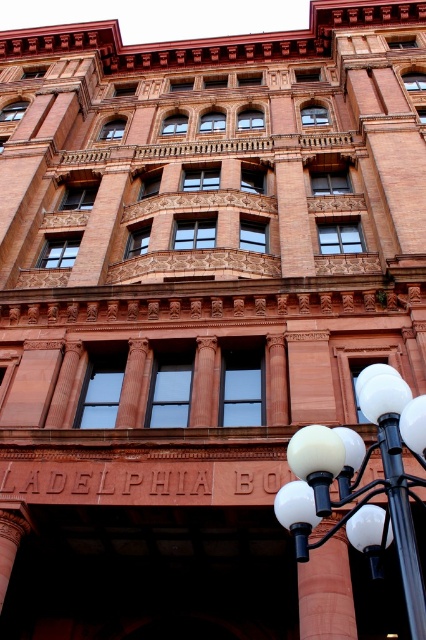
You are standing in front of the grand building and want to determine the relative positions of two points marked on its facade. Which of the two points, point (317, 490) or point (402, 470), is closer to you?

Point (317, 490) is closer to you because it is further to the viewer than point (402, 470).

You are standing in front of the grand building named ADELPHIA. You notice a white glass street light at lower right and a black metal pole at lower right. Which object is located above the other?

The white glass street light at lower right is positioned over the black metal pole at lower right, so it is above the black metal pole at lower right.

You are standing in front of the building named ADELPHIA and notice two objects at the lower right corner. Which one is wider between the white glass street light at lower right and the black metal pole at lower right?

The white glass street light at lower right is wider than the black metal pole at lower right according to the description.